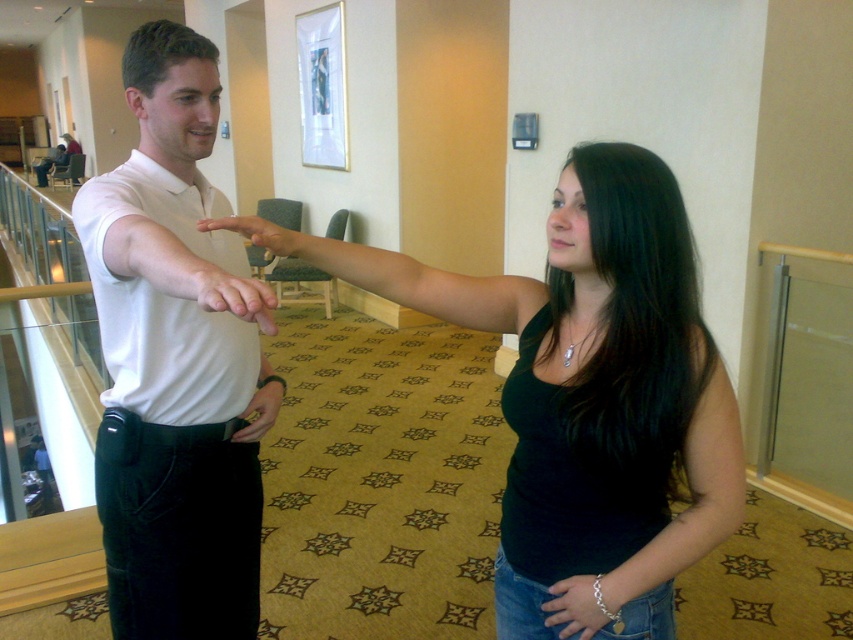
You are trying to decide which clothing item to choose for a casual day out. Both the black matte tank top at center and the white matte shirt at center are available. Based on their sizes, which one has a larger width?

The black matte tank top at center might be wider than the white matte shirt at center, so it could be the better choice if you prefer a wider fit.

You are a fashion designer observing two models wearing different tops in a photoshoot. The models are standing side by side in the center of the image. Which top has a shorter length between the black matte tank top at center and the white matte shirt at center?

The black matte tank top at center is shorter than the white matte shirt at center, so the black matte tank top at center has the shorter length.

You are standing in a modern indoor setting and see two people pointing in the same direction. The white matte shirt at center and black matte tank top at center are both facing forward. Which person is closer to you?

The black matte tank top at center is closer to you because the white matte shirt at center is behind it.